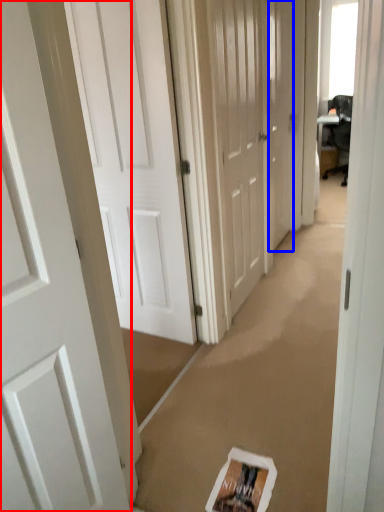
Question: Which of the following is the closest to the observer, door (highlighted by a red box) or door (highlighted by a blue box)?

Choices:
 (A) door
 (B) door

Answer: (A)